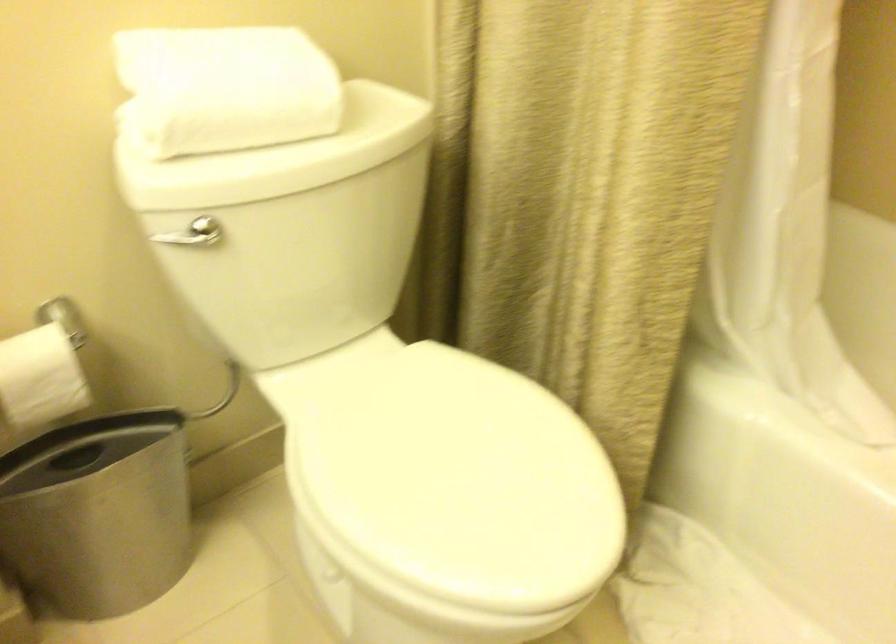
Identify the location of toilet flush handle. (192, 232).